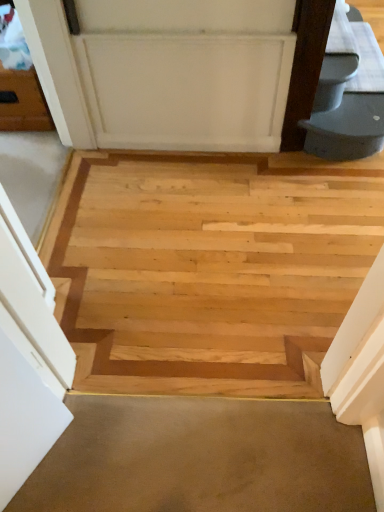
Where is `natural wood stairwell at center`? This screenshot has width=384, height=512. natural wood stairwell at center is located at coordinates (209, 268).

Describe the element at coordinates (209, 268) in the screenshot. I see `natural wood stairwell at center` at that location.

Where is `natural wood stairwell at center`? natural wood stairwell at center is located at coordinates (209, 268).